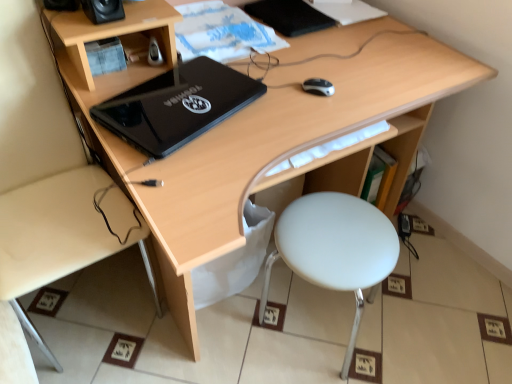
Locate an element on the screen. The height and width of the screenshot is (384, 512). free space to the right of black plastic speaker at upper left, which is the first speaker from left to right is located at coordinates (143, 10).